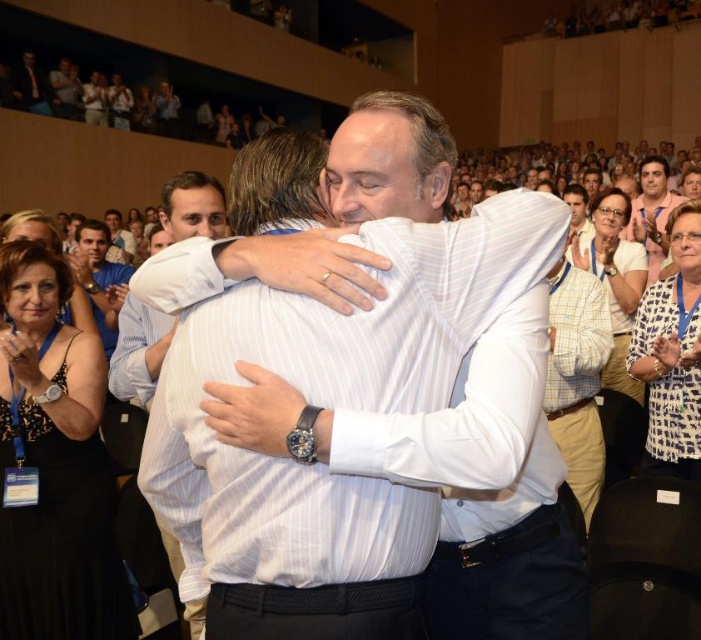
You are an event organizer arranging seating for a photo op. You need to place the black dotted dress at lower left and the matte white shirt at upper center in a row. Which one should you place first if you want the thinner item to be on the left side of the row?

The black dotted dress at lower left is thinner than the matte white shirt at upper center, so you should place the black dotted dress at lower left first to have the thinner item on the left side of the row.

You are an event photographer at a conference. You need to capture a photo that includes both the white striped shirt at center and the dark blue shirt at upper left. Based on their positions, which shirt should you focus on first to ensure both are in frame?

The white striped shirt at center is positioned on the right side of dark blue shirt at upper left, so you should focus on the dark blue shirt at upper left first to ensure both are in frame.

You are attending a conference and see two people in the crowd. One is wearing a white striped shirt at center and the other is wearing a dark blue shirt at upper left. From your current position, which person is closer to you?

The white striped shirt at center is closer to you because it is in front of the dark blue shirt at upper left in the image.